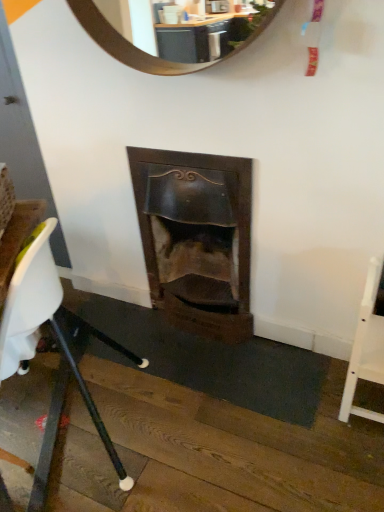
Find the location of `free space to the left of white wood chair at right, placed as the 2th chair when sorted from left to right`. free space to the left of white wood chair at right, placed as the 2th chair when sorted from left to right is located at coordinates (304, 398).